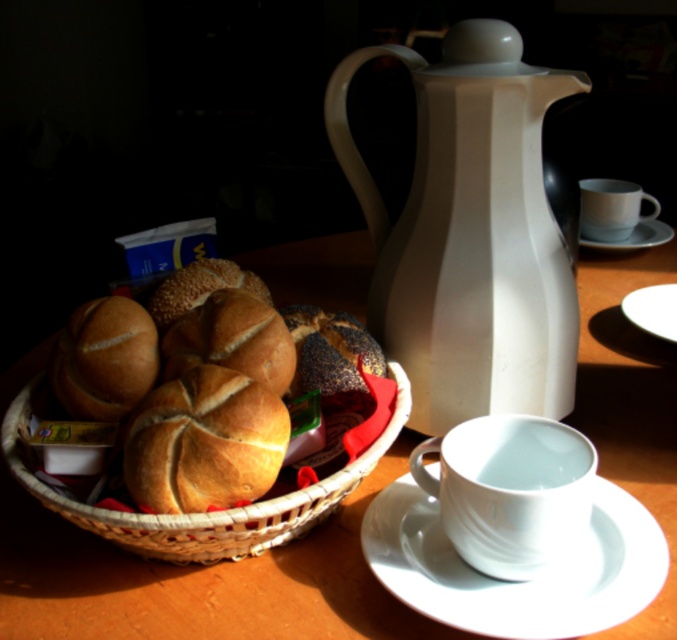
You are a person with a height of 1.7 meters. You are standing in front of the matte white table at center. Can you comfortably reach the items on the table without needing to stretch or bend over?

The matte white table at center is 33.47 centimeters away from you. Since the table height is not provided, it is impossible to determine if you can comfortably reach the items without stretching or bending over.

You are sitting at the wooden table and want to pour milk into a cup. The white glossy jug at center and the golden brown bread at center are both on the table. Which object is closer to you?

The white glossy jug at center is closer to you than the golden brown bread at center.

You are a chef standing at the edge of the table. You need to place a 12 inch long knife on the table without moving any existing items. Is there enough space between the white ceramic saucer at lower right and the edge of the table to fit the knife horizontally?

The distance between the white ceramic saucer at lower right and the viewer is 12.69 inches. Since the knife is 12 inches long, there is enough space to place it horizontally between the saucer and the edge of the table.